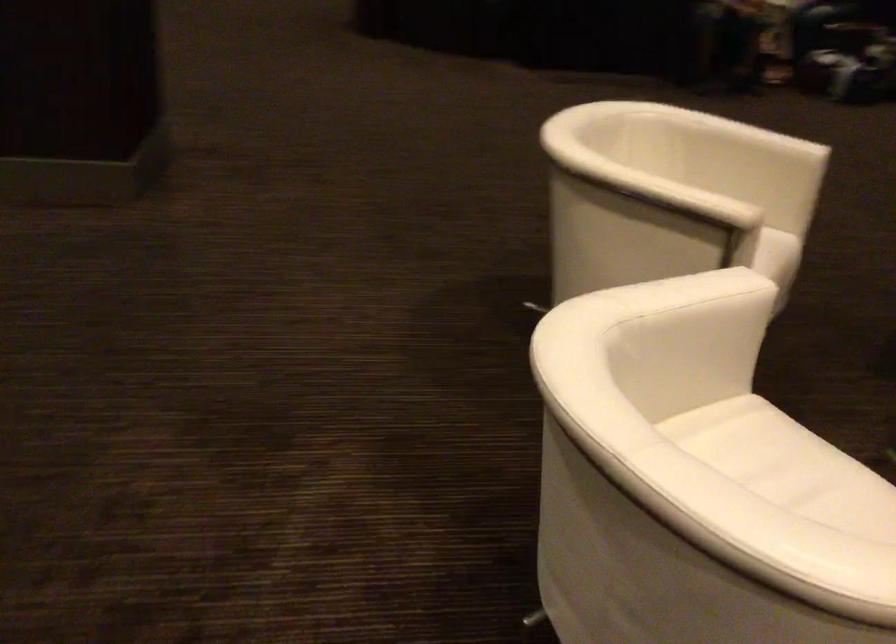
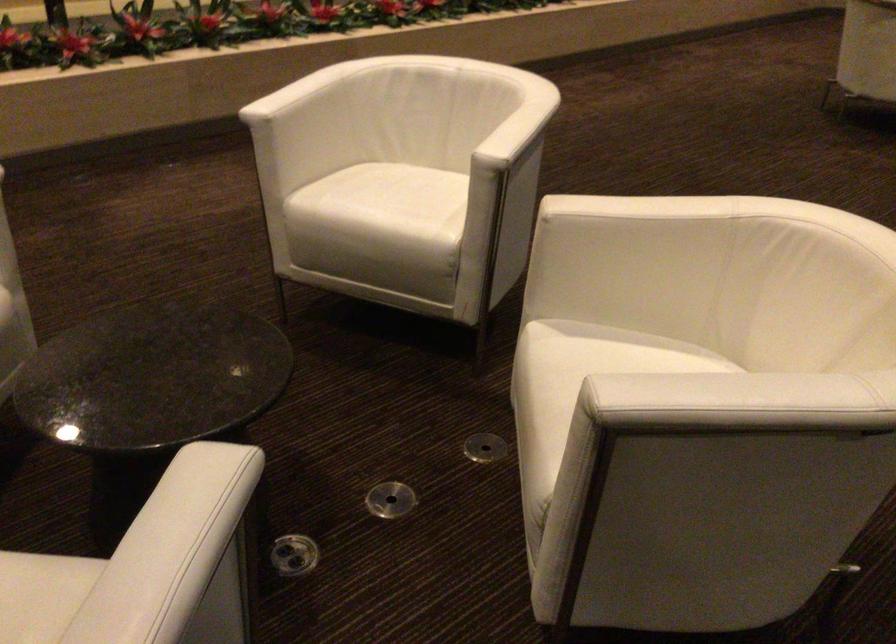
The point at [743,120] is marked in the first image. Where is the corresponding point in the second image?

(737, 402)